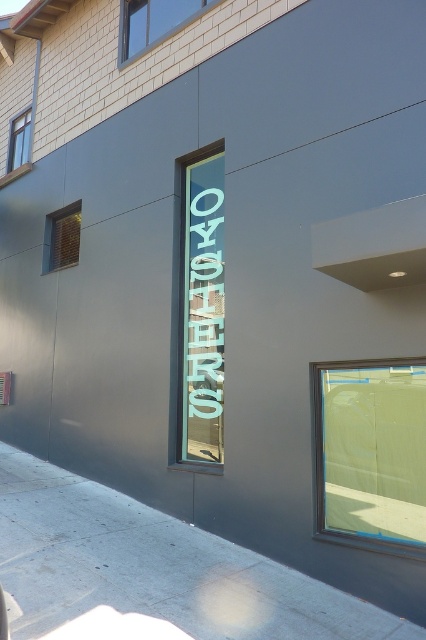
Looking at this image, is the position of clear glass window at center more distant than that of clear glass window at upper left?

No, it is not.

Who is shorter, clear glass window at center or clear glass window at upper left?

Standing shorter between the two is clear glass window at upper left.

Between point (396, 548) and point (69, 252), which one is positioned behind?

Point (69, 252)

In order to click on clear glass window at center in this screenshot , I will do `click(371, 452)`.

Does clear glass window at center appear on the right side of wooden window at upper left?

Yes, clear glass window at center is to the right of wooden window at upper left.

Does clear glass window at center appear over wooden window at upper left?

Actually, clear glass window at center is below wooden window at upper left.

Does point (371, 516) lie behind point (14, 124)?

That is False.

At what (x,y) coordinates should I click in order to perform the action: click on clear glass window at center. Please return your answer as a coordinate pair (x, y). Looking at the image, I should click on click(371, 452).

Is gray concrete sidewalk at lower left smaller than white glass window at upper center?

Yes.

Is point (75, 529) less distant than point (143, 36)?

Yes, point (75, 529) is closer to viewer.

Locate an element on the screen. gray concrete sidewalk at lower left is located at coordinates (154, 566).